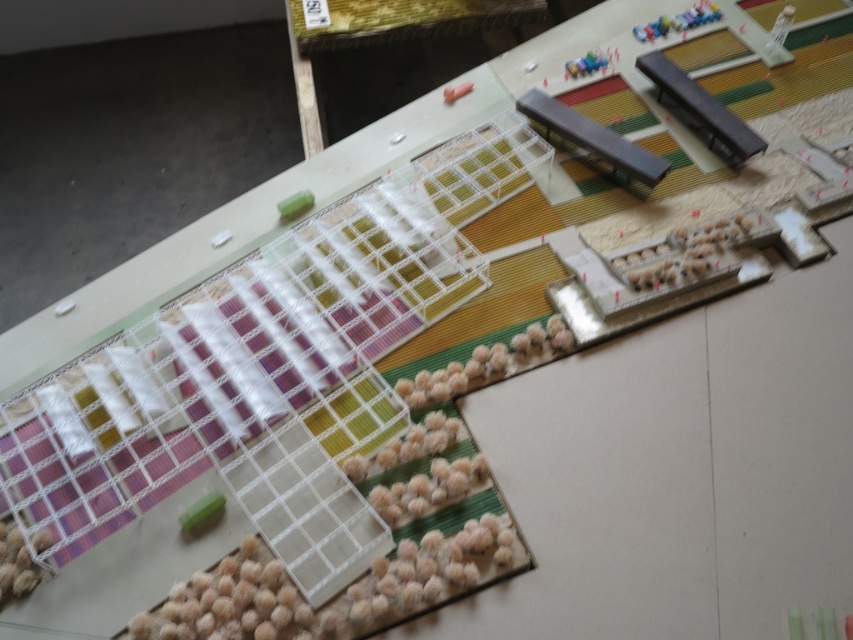
You are standing at the center of the model landscape and want to place a small tree. The tree requires a space that is at least 0.2 meters wide. Is the area at point (294,204) suitable for planting the tree?

The area at point (294,204) has a green matte cube at center left which is 0.2 meters wide, so the tree can be planted there.